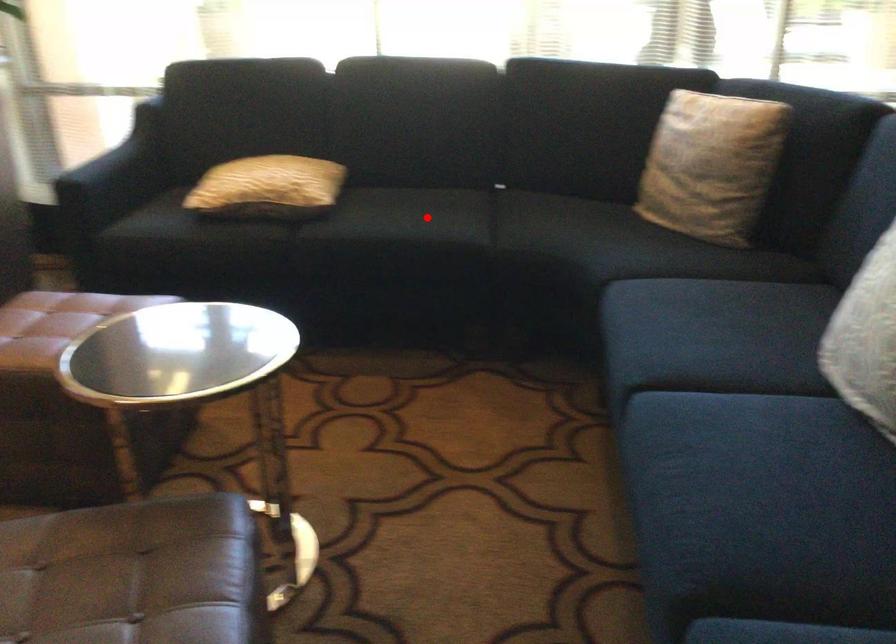
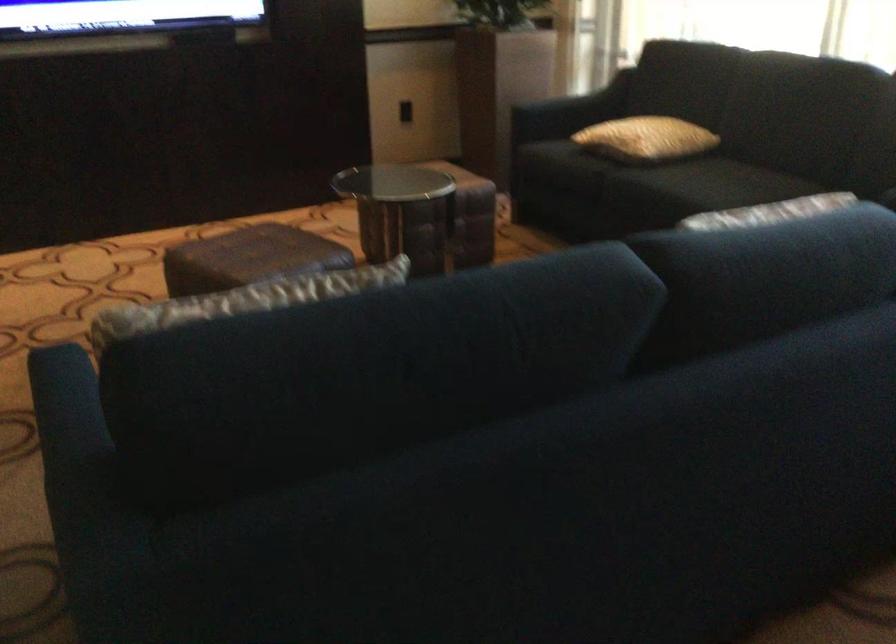
Question: I am providing you with two images of the same scene from different viewpoints. In image1, a red point is highlighted. Considering the same 3D point in image2, which of the following is correct?

Choices:
 (A) It is closer
 (B) It is farther

Answer: (B)